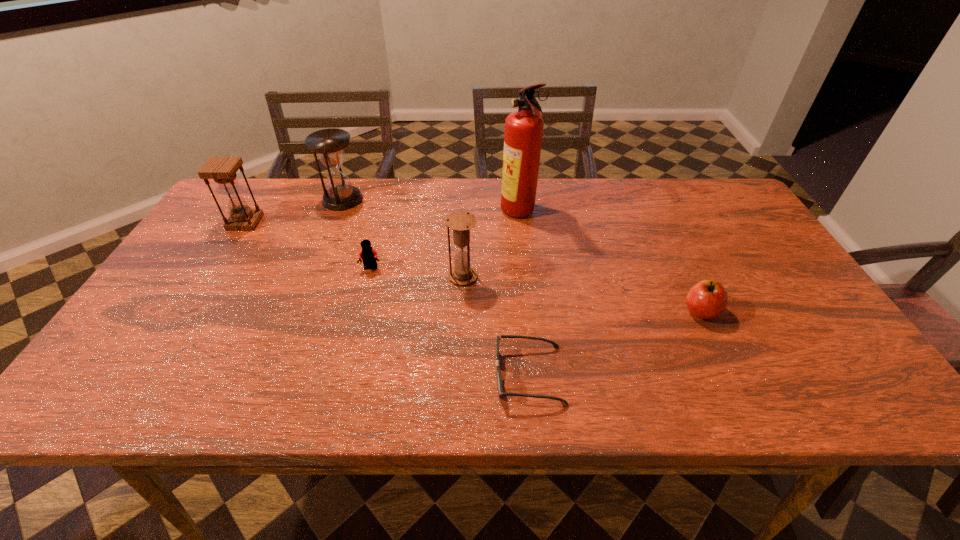
Where is `vacant region located on the face of the spectacles`? The width and height of the screenshot is (960, 540). vacant region located on the face of the spectacles is located at coordinates (315, 375).

In order to click on free space located on the face of the spectacles in this screenshot , I will do `click(354, 375)`.

At what (x,y) coordinates should I click in order to perform the action: click on blank area located on the face of the spectacles. Please return your answer as a coordinate pair (x, y). The width and height of the screenshot is (960, 540). Looking at the image, I should click on (397, 375).

Identify the location of fire extinguisher present at the far edge. coord(523,134).

In order to click on object positioned at the near edge in this screenshot , I will do `click(499, 381)`.

Image resolution: width=960 pixels, height=540 pixels. In order to click on object that is at the left edge in this screenshot , I will do `click(222, 170)`.

Where is `object at the far left corner`? object at the far left corner is located at coordinates (222, 170).

In the image, there is a desktop. Where is `free space at the far edge`? free space at the far edge is located at coordinates (323, 189).

This screenshot has height=540, width=960. Identify the location of vacant space at the near edge. (432, 372).

At what (x,y) coordinates should I click in order to perform the action: click on vacant space at the far right corner of the desktop. Please return your answer as a coordinate pair (x, y). Looking at the image, I should click on (708, 180).